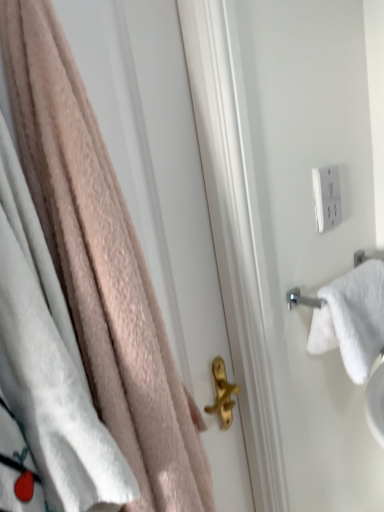
Find the location of a particular element. This screenshot has height=512, width=384. soft pink towel at left, marked as the 2th towel in a right-to-left arrangement is located at coordinates (101, 265).

Identify the location of white plastic outlet at upper right. (326, 197).

Is soft pink towel at left, positioned as the 1th towel in front-to-back order, facing towards white plastic outlet at upper right?

No, soft pink towel at left, positioned as the 1th towel in front-to-back order, does not turn towards white plastic outlet at upper right.

Is soft pink towel at left, positioned as the 1th towel in front-to-back order, completely or partially outside of white plastic outlet at upper right?

Yes, soft pink towel at left, positioned as the 1th towel in front-to-back order, is outside of white plastic outlet at upper right.

In the scene shown: Does soft pink towel at left, positioned as the 1th towel in front-to-back order, have a lesser height compared to white plastic outlet at upper right?

Incorrect, the height of soft pink towel at left, positioned as the 1th towel in front-to-back order, does not fall short of that of white plastic outlet at upper right.

From a real-world perspective, which is physically above, white cotton towel at right, which is counted as the second towel, starting from the front, or soft pink towel at left, marked as the 2th towel in a right-to-left arrangement?

soft pink towel at left, marked as the 2th towel in a right-to-left arrangement, is physically above.

Based on their positions, is white cotton towel at right, positioned as the 2th towel in left-to-right order, located to the left or right of soft pink towel at left, positioned as the 1th towel in front-to-back order?

From the image, it's evident that white cotton towel at right, positioned as the 2th towel in left-to-right order, is to the right of soft pink towel at left, positioned as the 1th towel in front-to-back order.

Considering the points (364, 369) and (69, 151), which point is behind, point (364, 369) or point (69, 151)?

Point (364, 369)

Between soft pink towel at left, positioned as the 1th towel in front-to-back order, and white cotton towel at right, which is counted as the second towel, starting from the front, which one has less height?

With less height is white cotton towel at right, which is counted as the second towel, starting from the front.

Does soft pink towel at left, which appears as the first towel when viewed from the left, appear on the right side of white cotton towel at right, which is counted as the second towel, starting from the front?

No.

Is soft pink towel at left, positioned as the 1th towel in front-to-back order, positioned far away from white cotton towel at right, acting as the 1th towel starting from the back?

No, soft pink towel at left, positioned as the 1th towel in front-to-back order, is in close proximity to white cotton towel at right, acting as the 1th towel starting from the back.

Does soft pink towel at left, which appears as the first towel when viewed from the left, contain white cotton towel at right, acting as the 1th towel starting from the back?

No, white cotton towel at right, acting as the 1th towel starting from the back, is not surrounded by soft pink towel at left, which appears as the first towel when viewed from the left.

Is white cotton towel at right, positioned as the 2th towel in left-to-right order, thinner than white plastic outlet at upper right?

Incorrect, the width of white cotton towel at right, positioned as the 2th towel in left-to-right order, is not less than that of white plastic outlet at upper right.

Is white cotton towel at right, which is counted as the second towel, starting from the front, at the left side of white plastic outlet at upper right?

No, white cotton towel at right, which is counted as the second towel, starting from the front, is not to the left of white plastic outlet at upper right.

Which of these two, white cotton towel at right, which is counted as the second towel, starting from the front, or white plastic outlet at upper right, is smaller?

white plastic outlet at upper right.

Is white cotton towel at right, marked as the 1th towel in a right-to-left arrangement, turned away from white plastic outlet at upper right?

That's not correct — white cotton towel at right, marked as the 1th towel in a right-to-left arrangement, is not looking away from white plastic outlet at upper right.

Looking at this image, could you measure the distance between white plastic outlet at upper right and white cotton towel at right, which is counted as the second towel, starting from the front?

white plastic outlet at upper right is 8.80 inches away from white cotton towel at right, which is counted as the second towel, starting from the front.

Considering the sizes of white plastic outlet at upper right and white cotton towel at right, positioned as the 2th towel in left-to-right order, in the image, is white plastic outlet at upper right taller or shorter than white cotton towel at right, positioned as the 2th towel in left-to-right order,?

In the image, white plastic outlet at upper right appears to be shorter than white cotton towel at right, positioned as the 2th towel in left-to-right order.

Could you tell me if white plastic outlet at upper right is facing white cotton towel at right, marked as the 1th towel in a right-to-left arrangement?

No, white plastic outlet at upper right is not aimed at white cotton towel at right, marked as the 1th towel in a right-to-left arrangement.

From the picture: Considering the positions of objects white plastic outlet at upper right and white cotton towel at right, which is counted as the second towel, starting from the front, in the image provided, who is more to the right, white plastic outlet at upper right or white cotton towel at right, which is counted as the second towel, starting from the front,?

white cotton towel at right, which is counted as the second towel, starting from the front.

Considering the sizes of white plastic outlet at upper right and soft pink towel at left, which appears as the second towel when viewed from the back, in the image, is white plastic outlet at upper right wider or thinner than soft pink towel at left, which appears as the second towel when viewed from the back,?

Clearly, white plastic outlet at upper right has less width compared to soft pink towel at left, which appears as the second towel when viewed from the back.

Which of these two, white plastic outlet at upper right or soft pink towel at left, which appears as the second towel when viewed from the back, stands taller?

Standing taller between the two is soft pink towel at left, which appears as the second towel when viewed from the back.

From a real-world perspective, who is located lower, white plastic outlet at upper right or soft pink towel at left, marked as the 2th towel in a right-to-left arrangement?

From a 3D spatial view, soft pink towel at left, marked as the 2th towel in a right-to-left arrangement, is below.

From the image's perspective, which one is positioned lower, white plastic outlet at upper right or soft pink towel at left, marked as the 2th towel in a right-to-left arrangement?

soft pink towel at left, marked as the 2th towel in a right-to-left arrangement, appears lower in the image.

The height and width of the screenshot is (512, 384). I want to click on light switch on the right of soft pink towel at left, which appears as the first towel when viewed from the left, so click(326, 197).

The image size is (384, 512). Find the location of `towel that appears above the white cotton towel at right, which is counted as the second towel, starting from the front (from a real-world perspective)`. towel that appears above the white cotton towel at right, which is counted as the second towel, starting from the front (from a real-world perspective) is located at coordinates (101, 265).

Based on the photo, based on their spatial positions, is white plastic outlet at upper right or soft pink towel at left, which appears as the first towel when viewed from the left, closer to white cotton towel at right, positioned as the 2th towel in left-to-right order?

white plastic outlet at upper right lies closer to white cotton towel at right, positioned as the 2th towel in left-to-right order, than the other object.

From the image, which object appears to be nearer to soft pink towel at left, which appears as the second towel when viewed from the back, white plastic outlet at upper right or white cotton towel at right, acting as the 1th towel starting from the back?

The object closer to soft pink towel at left, which appears as the second towel when viewed from the back, is white cotton towel at right, acting as the 1th towel starting from the back.

Estimate the real-world distances between objects in this image. Which object is further from soft pink towel at left, which appears as the second towel when viewed from the back, white cotton towel at right, which is counted as the second towel, starting from the front, or white plastic outlet at upper right?

Among the two, white plastic outlet at upper right is located further to soft pink towel at left, which appears as the second towel when viewed from the back.

Considering their positions, is soft pink towel at left, which appears as the second towel when viewed from the back, positioned further to white cotton towel at right, positioned as the 2th towel in left-to-right order, than white plastic outlet at upper right?

soft pink towel at left, which appears as the second towel when viewed from the back, lies further to white cotton towel at right, positioned as the 2th towel in left-to-right order, than the other object.

Considering their positions, is soft pink towel at left, positioned as the 1th towel in front-to-back order, positioned further to white plastic outlet at upper right than white cotton towel at right, positioned as the 2th towel in left-to-right order?

soft pink towel at left, positioned as the 1th towel in front-to-back order, lies further to white plastic outlet at upper right than the other object.

Estimate the real-world distances between objects in this image. Which object is closer to white plastic outlet at upper right, white cotton towel at right, marked as the 1th towel in a right-to-left arrangement, or soft pink towel at left, which appears as the second towel when viewed from the back?

Based on the image, white cotton towel at right, marked as the 1th towel in a right-to-left arrangement, appears to be nearer to white plastic outlet at upper right.

I want to click on towel between soft pink towel at left, which appears as the first towel when viewed from the left, and white plastic outlet at upper right, along the z-axis, so click(352, 319).